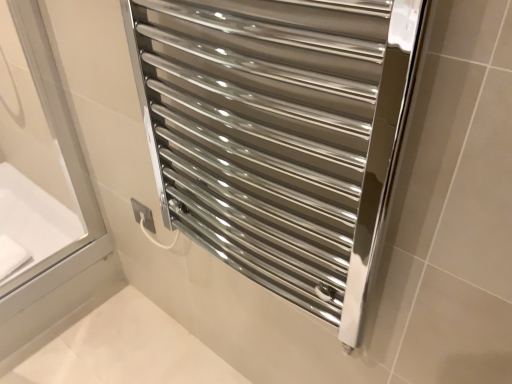
Question: Is polished chrome towel rack at center located outside white glossy bathtub at left?

Choices:
 (A) yes
 (B) no

Answer: (A)

Question: Does polished chrome towel rack at center have a lesser width compared to white glossy bathtub at left?

Choices:
 (A) no
 (B) yes

Answer: (B)

Question: Does polished chrome towel rack at center touch white glossy bathtub at left?

Choices:
 (A) no
 (B) yes

Answer: (A)

Question: Considering the relative sizes of polished chrome towel rack at center and white glossy bathtub at left in the image provided, is polished chrome towel rack at center bigger than white glossy bathtub at left?

Choices:
 (A) no
 (B) yes

Answer: (B)

Question: Does polished chrome towel rack at center have a lesser height compared to white glossy bathtub at left?

Choices:
 (A) no
 (B) yes

Answer: (A)

Question: Is polished chrome towel rack at center in front of white glossy bathtub at left?

Choices:
 (A) yes
 (B) no

Answer: (A)

Question: From a real-world perspective, is white glossy bathtub at left physically above polished chrome towel rack at center?

Choices:
 (A) yes
 (B) no

Answer: (B)

Question: Is white glossy bathtub at left with polished chrome towel rack at center?

Choices:
 (A) yes
 (B) no

Answer: (B)

Question: Is white glossy bathtub at left bigger than polished chrome towel rack at center?

Choices:
 (A) no
 (B) yes

Answer: (A)

Question: Does white glossy bathtub at left appear on the right side of polished chrome towel rack at center?

Choices:
 (A) no
 (B) yes

Answer: (A)

Question: Can you confirm if white glossy bathtub at left is thinner than polished chrome towel rack at center?

Choices:
 (A) yes
 (B) no

Answer: (B)

Question: Is white glossy bathtub at left facing towards polished chrome towel rack at center?

Choices:
 (A) yes
 (B) no

Answer: (B)

Question: Relative to white glossy bathtub at left, is polished chrome towel rack at center in front or behind?

Choices:
 (A) behind
 (B) front

Answer: (B)